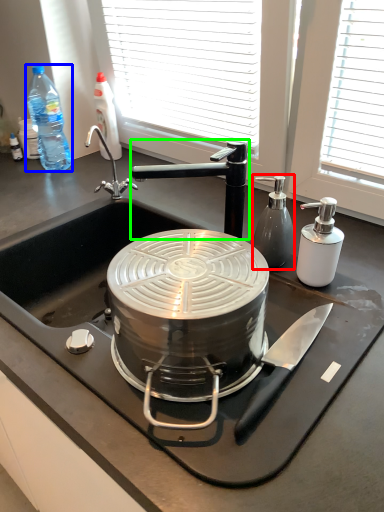
Question: Estimate the real-world distances between objects in this image. Which object is closer to bottle (highlighted by a red box), bottle (highlighted by a blue box) or tap (highlighted by a green box)?

Choices:
 (A) bottle
 (B) tap

Answer: (B)